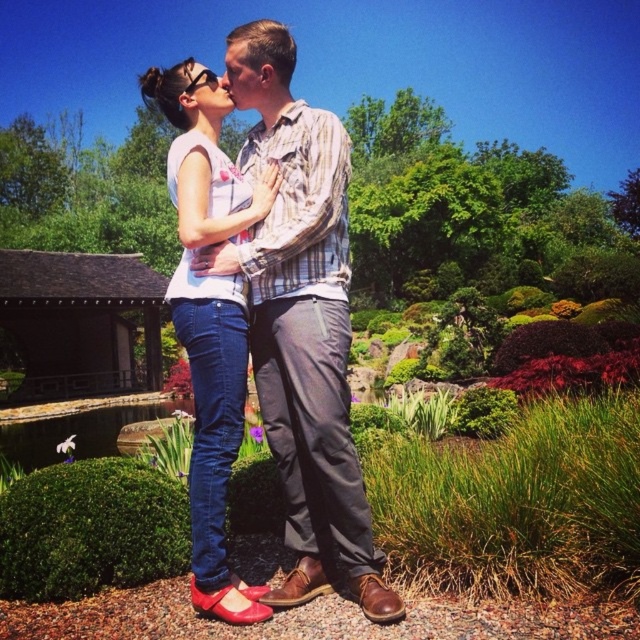
Question: Which point is farther to the camera?

Choices:
 (A) (209, 300)
 (B) (321, 582)

Answer: (B)

Question: Does brown leather shoes at center appear on the right side of matte white blouse at center?

Choices:
 (A) no
 (B) yes

Answer: (B)

Question: Which point is farther to the camera?

Choices:
 (A) (216, 182)
 (B) (248, 97)

Answer: (B)

Question: Can you confirm if brown leather shoes at center is positioned above matte white blouse at center?

Choices:
 (A) yes
 (B) no

Answer: (B)

Question: Does brown leather shoes at center have a smaller size compared to matte white blouse at center?

Choices:
 (A) yes
 (B) no

Answer: (A)